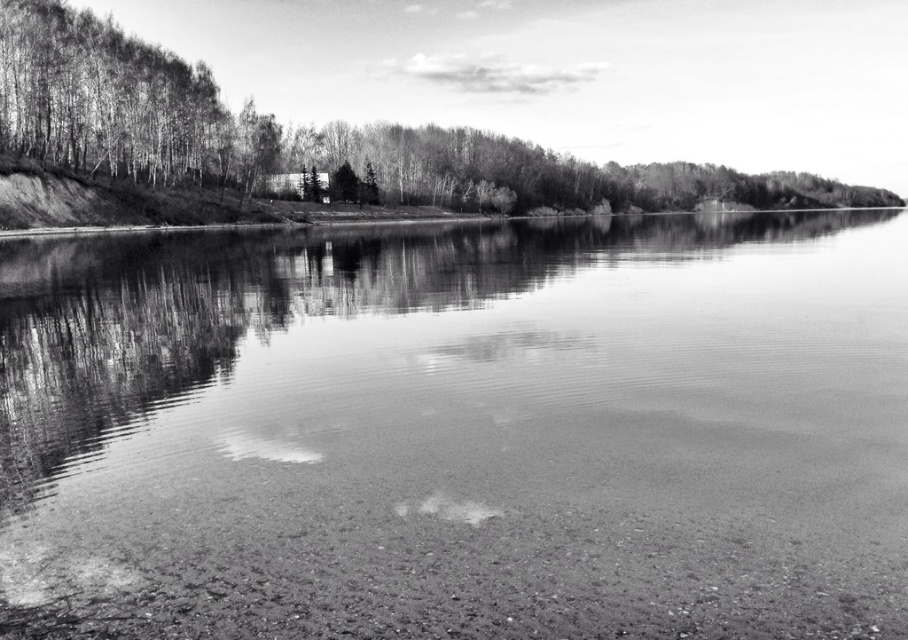
Between smooth water at center and smooth bark tree at upper left, which one has more height?

With more height is smooth bark tree at upper left.

In the scene shown: Does smooth water at center appear over smooth bark tree at upper left?

Actually, smooth water at center is below smooth bark tree at upper left.

Find the location of a particular element. The height and width of the screenshot is (640, 908). smooth water at center is located at coordinates (459, 432).

Identify the location of smooth water at center. [459, 432].